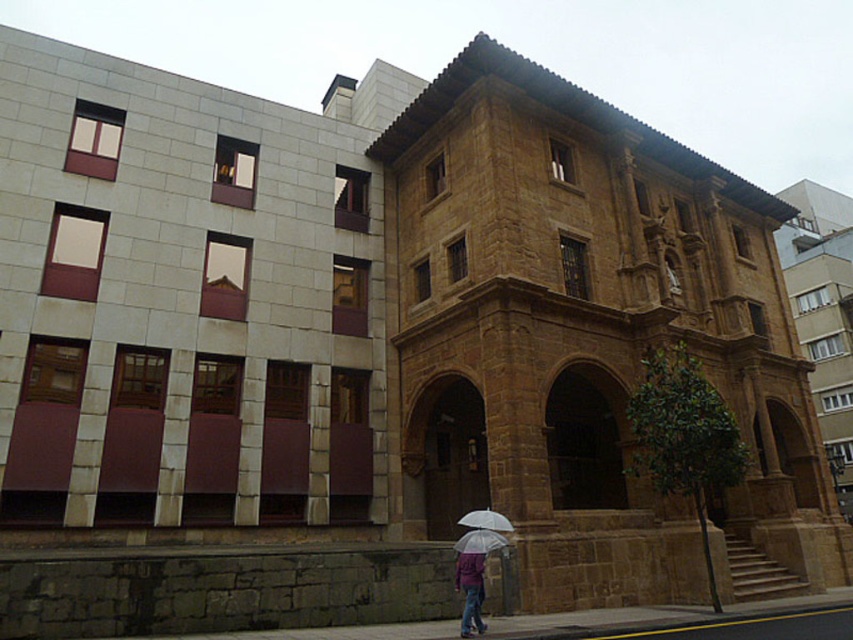
Question: Among these points, which one is nearest to the camera?

Choices:
 (A) (469, 548)
 (B) (480, 621)

Answer: (B)

Question: Is transparent plastic umbrella at center below white matte umbrella at center?

Choices:
 (A) no
 (B) yes

Answer: (A)

Question: Which point is farther to the camera?

Choices:
 (A) purple matte jacket at lower center
 (B) transparent plastic umbrella at center

Answer: (B)

Question: Does purple matte jacket at lower center appear over transparent plastic umbrella at center?

Choices:
 (A) yes
 (B) no

Answer: (B)

Question: Which point appears farthest from the camera in this image?

Choices:
 (A) (488, 528)
 (B) (480, 547)

Answer: (A)

Question: Does transparent plastic umbrella at center have a lesser width compared to white matte umbrella at center?

Choices:
 (A) no
 (B) yes

Answer: (B)